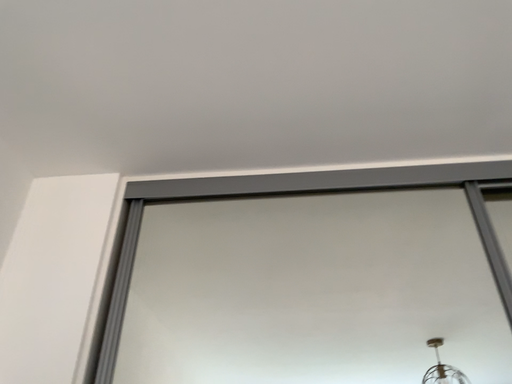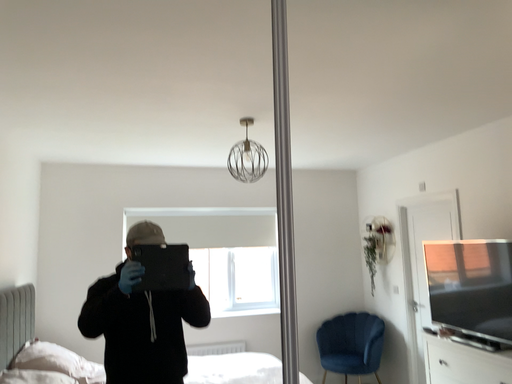
Question: Which way did the camera rotate in the video?

Choices:
 (A) rotated downward
 (B) rotated upward

Answer: (A)